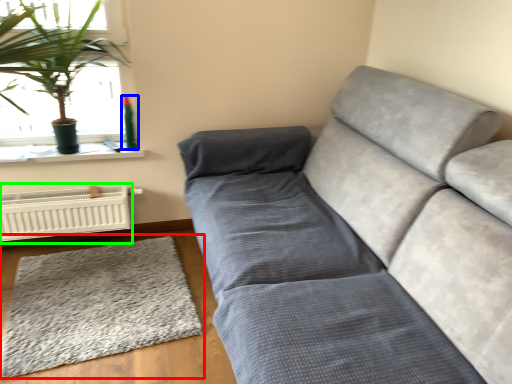
Question: Estimate the real-world distances between objects in this image. Which object is closer to mat (highlighted by a red box), teal (highlighted by a blue box) or heater (highlighted by a green box)?

Choices:
 (A) teal
 (B) heater

Answer: (B)